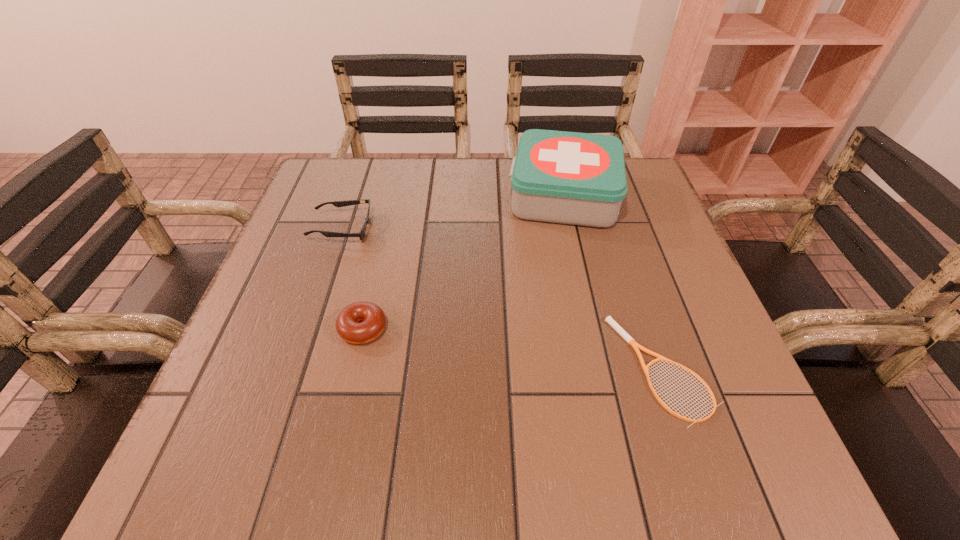
Find the location of a particular element. vacant region at the right edge is located at coordinates (738, 374).

Image resolution: width=960 pixels, height=540 pixels. Find the location of `free space at the far left corner of the desktop`. free space at the far left corner of the desktop is located at coordinates (333, 198).

Find the location of a particular element. This screenshot has width=960, height=540. free space at the near right corner is located at coordinates (762, 427).

Identify the location of vacant point located between the tennis racket and the doughnut. (513, 349).

This screenshot has width=960, height=540. I want to click on free space that is in between the first-aid kit and the shortest object, so click(613, 282).

Identify the location of vacant area between the sunglasses and the doughnut. (352, 279).

Identify the location of vacant space that is in between the doughnut and the sunglasses. (352, 279).

At what (x,y) coordinates should I click in order to perform the action: click on vacant space that is in between the tennis racket and the first-aid kit. Please return your answer as a coordinate pair (x, y). Image resolution: width=960 pixels, height=540 pixels. Looking at the image, I should click on (613, 282).

Locate an element on the screen. Image resolution: width=960 pixels, height=540 pixels. empty space between the doughnut and the first-aid kit is located at coordinates (464, 262).

The image size is (960, 540). Identify the location of empty location between the doughnut and the sunglasses. (352, 279).